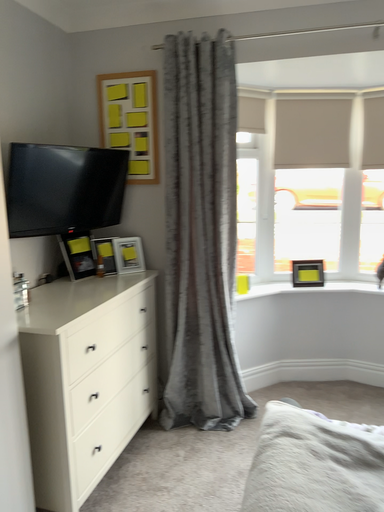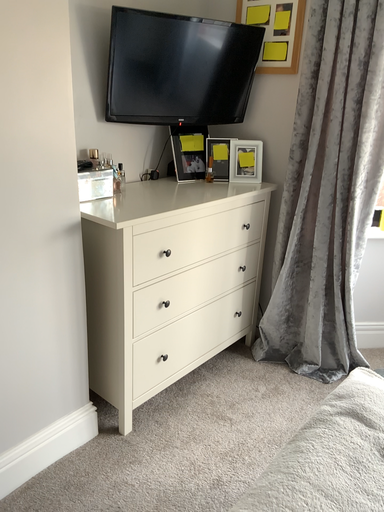
Question: Which way did the camera rotate in the video?

Choices:
 (A) rotated downward
 (B) rotated upward

Answer: (A)